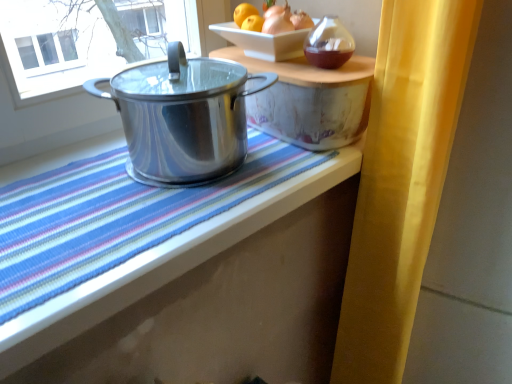
What are the coordinates of `vacant space positioned to the left of shiny metallic pot at left` in the screenshot? It's located at [75, 168].